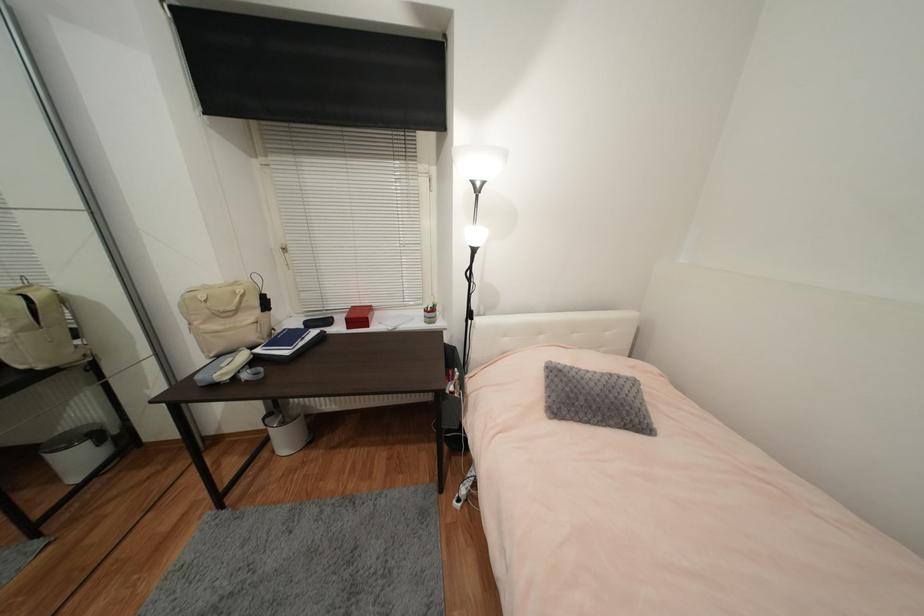
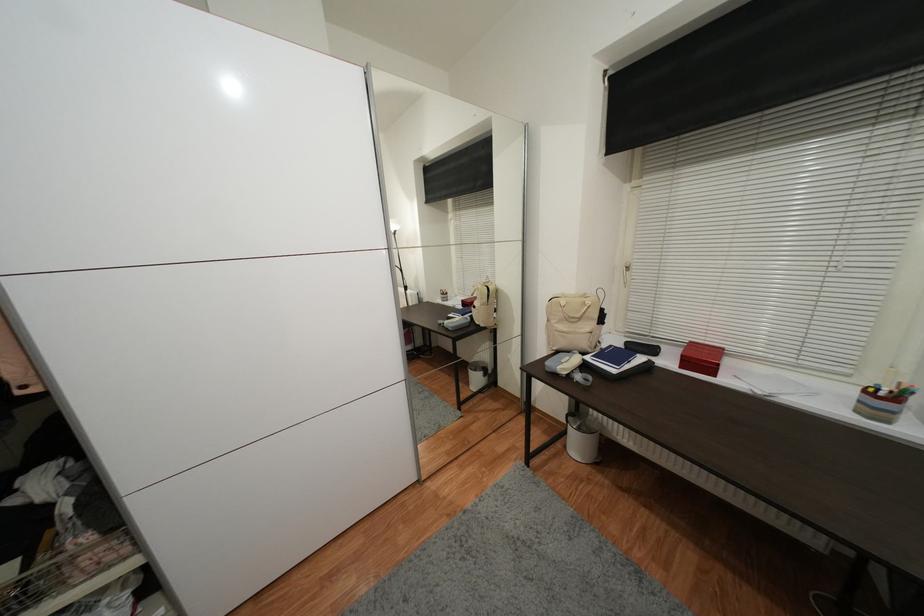
The point at [298,154] is marked in the first image. Where is the corresponding point in the second image?

(678, 167)